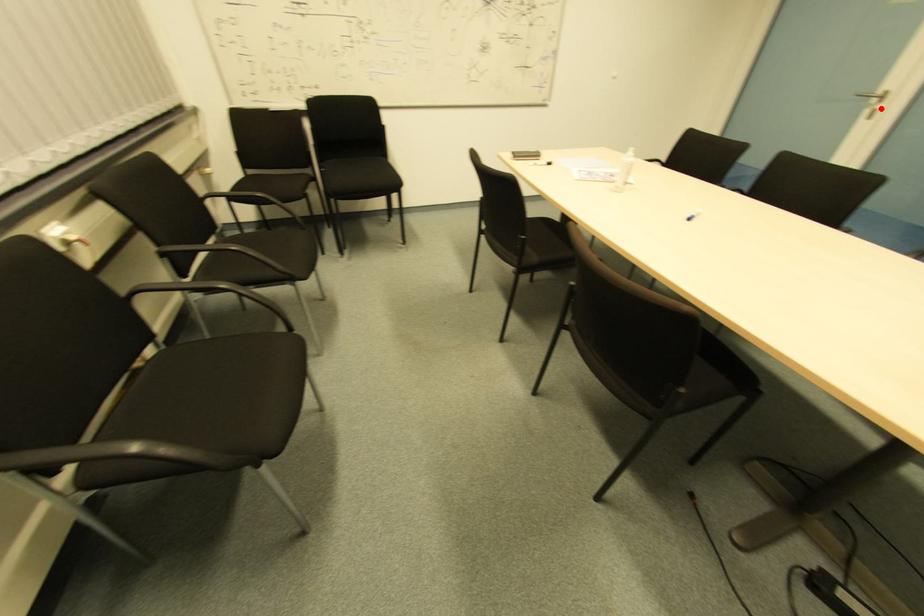
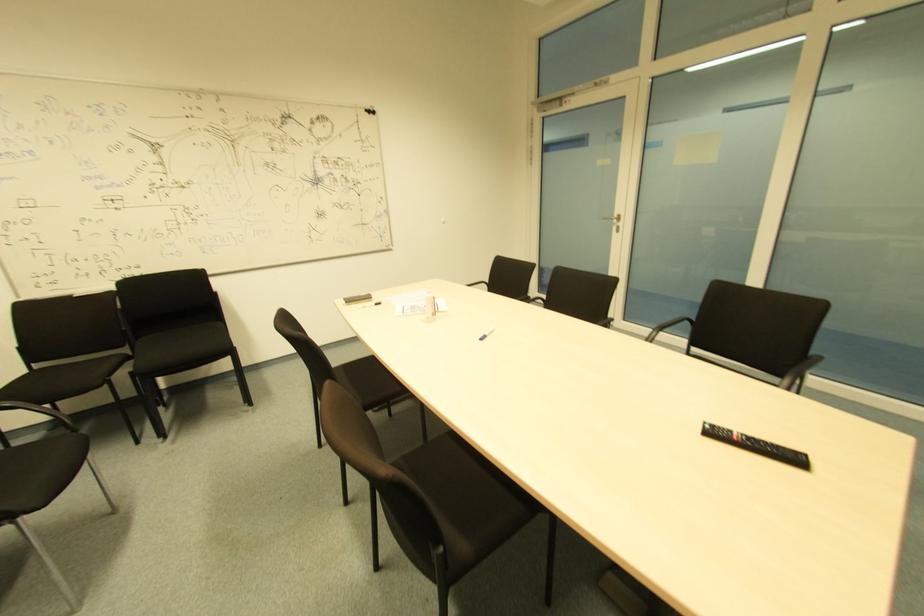
Question: I am providing you with two images of the same scene from different viewpoints. A red point is shown in image1. For the corresponding object point in image2, is it positioned nearer or farther from the camera?

Choices:
 (A) Nearer
 (B) Farther

Answer: (A)